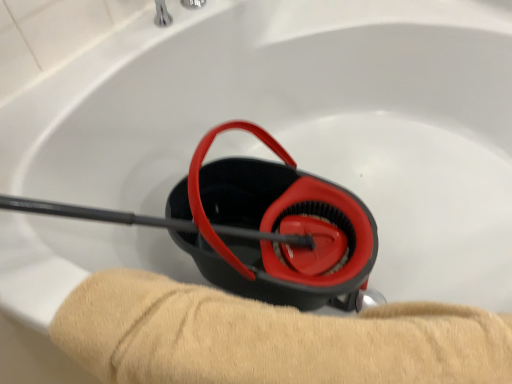
Question: Are silver metallic faucet at upper center and soft beige towel at lower center far apart?

Choices:
 (A) no
 (B) yes

Answer: (A)

Question: Is silver metallic faucet at upper center positioned with its back to soft beige towel at lower center?

Choices:
 (A) no
 (B) yes

Answer: (A)

Question: Is the position of silver metallic faucet at upper center more distant than that of soft beige towel at lower center?

Choices:
 (A) no
 (B) yes

Answer: (B)

Question: Is silver metallic faucet at upper center thinner than soft beige towel at lower center?

Choices:
 (A) yes
 (B) no

Answer: (A)

Question: Considering the relative sizes of silver metallic faucet at upper center and soft beige towel at lower center in the image provided, is silver metallic faucet at upper center wider than soft beige towel at lower center?

Choices:
 (A) no
 (B) yes

Answer: (A)

Question: Is silver metallic faucet at upper center smaller than soft beige towel at lower center?

Choices:
 (A) yes
 (B) no

Answer: (A)

Question: Does soft beige towel at lower center appear on the left side of silver metallic faucet at upper center?

Choices:
 (A) yes
 (B) no

Answer: (B)

Question: Considering the relative sizes of soft beige towel at lower center and silver metallic faucet at upper center in the image provided, is soft beige towel at lower center bigger than silver metallic faucet at upper center?

Choices:
 (A) yes
 (B) no

Answer: (A)

Question: Can silver metallic faucet at upper center be found inside soft beige towel at lower center?

Choices:
 (A) yes
 (B) no

Answer: (B)

Question: Can you confirm if soft beige towel at lower center is smaller than silver metallic faucet at upper center?

Choices:
 (A) no
 (B) yes

Answer: (A)

Question: Is soft beige towel at lower center positioned behind silver metallic faucet at upper center?

Choices:
 (A) yes
 (B) no

Answer: (B)

Question: Is silver metallic faucet at upper center at the back of soft beige towel at lower center?

Choices:
 (A) no
 (B) yes

Answer: (B)

Question: From the image's perspective, relative to silver metallic faucet at upper center, is soft beige towel at lower center above or below?

Choices:
 (A) above
 (B) below

Answer: (B)